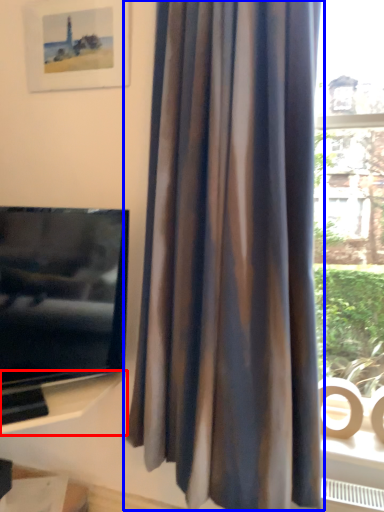
Question: Among these objects, which one is nearest to the camera, shelf (highlighted by a red box) or curtain (highlighted by a blue box)?

Choices:
 (A) shelf
 (B) curtain

Answer: (B)